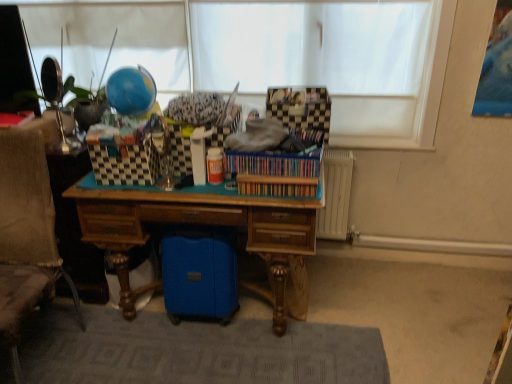
I want to click on spots to the right of wooden desk at center, so point(380,302).